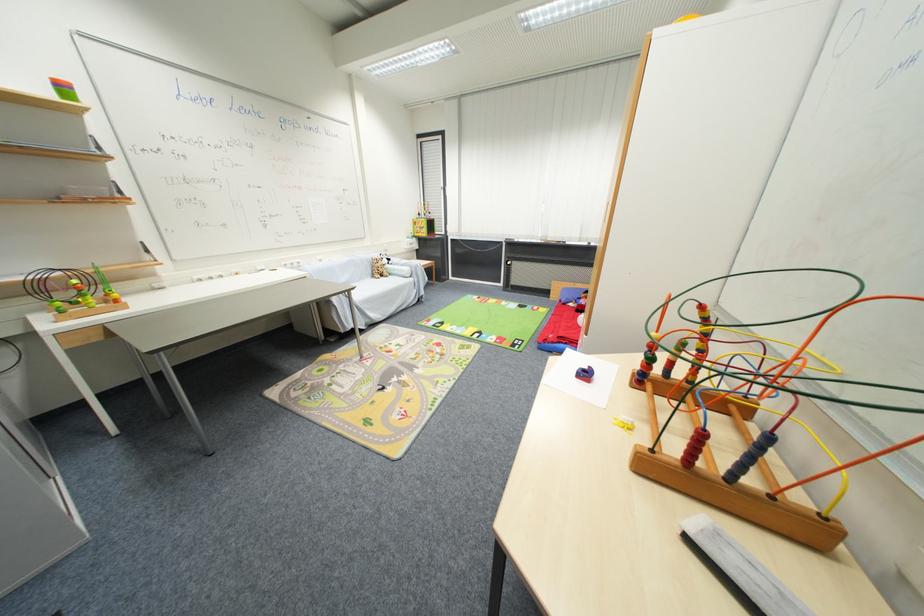
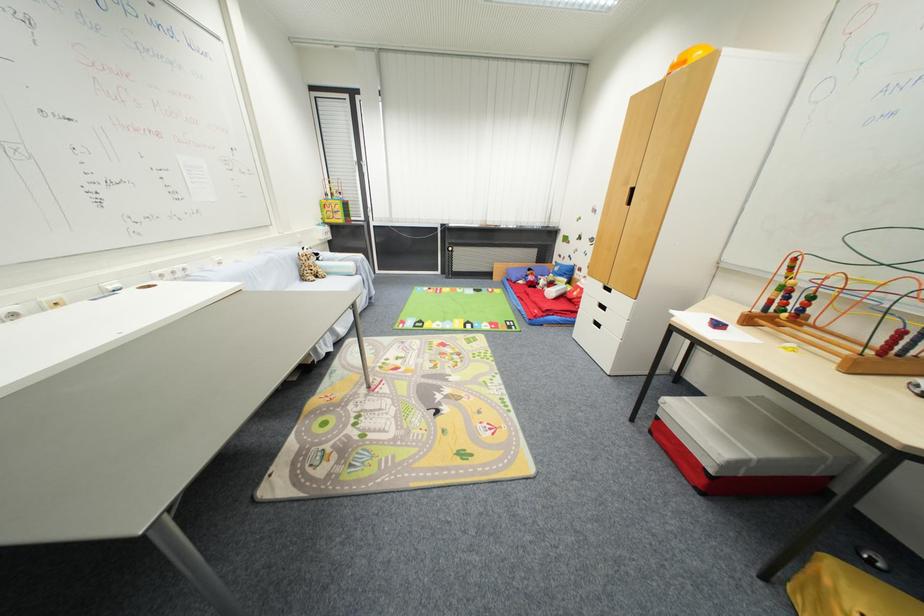
Where in the second image is the point corresponding to point (383, 274) from the first image?

(313, 274)